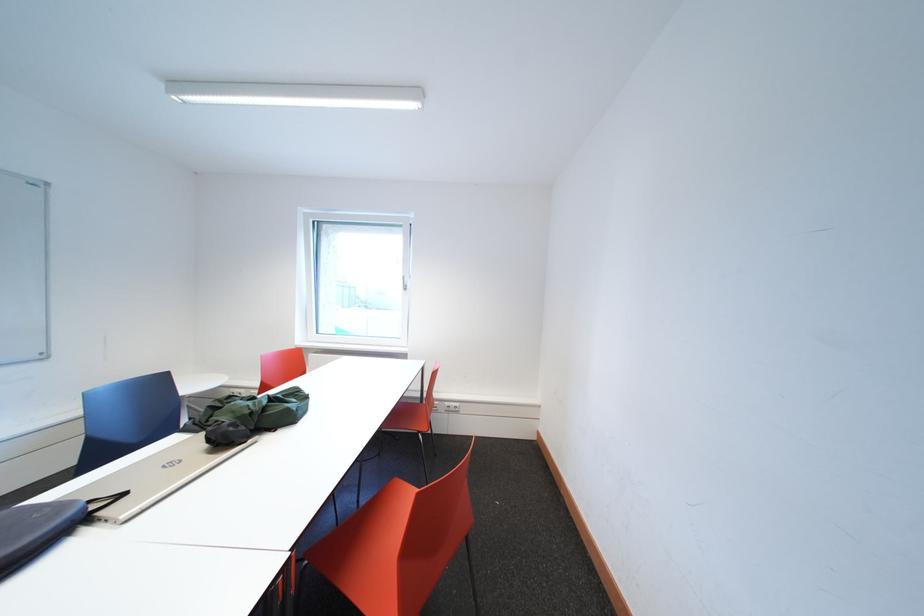
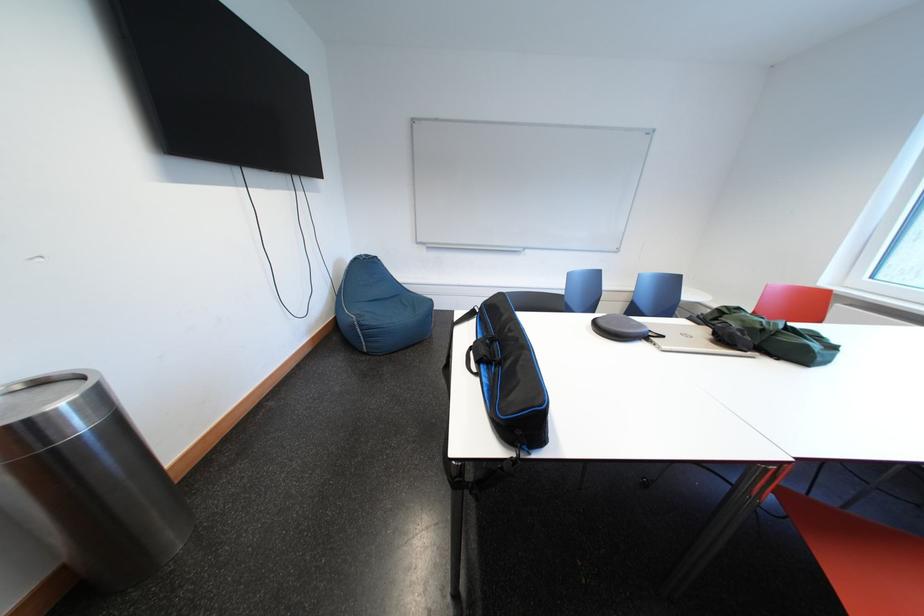
Locate, in the second image, the point that corresponds to pixel 91 525 in the first image.

(657, 341)